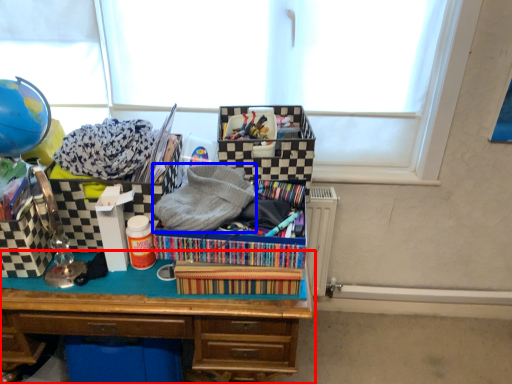
Question: Which point is further to the camera, desk (highlighted by a red box) or clothing (highlighted by a blue box)?

Choices:
 (A) desk
 (B) clothing

Answer: (A)